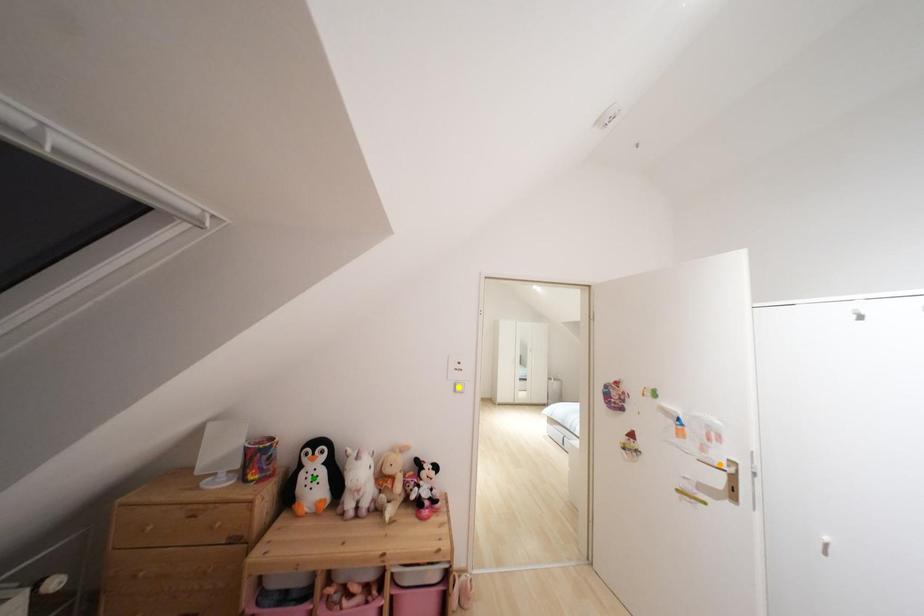
Order these from farthest to nearest:
orange point, yellow point, green point

yellow point → green point → orange point